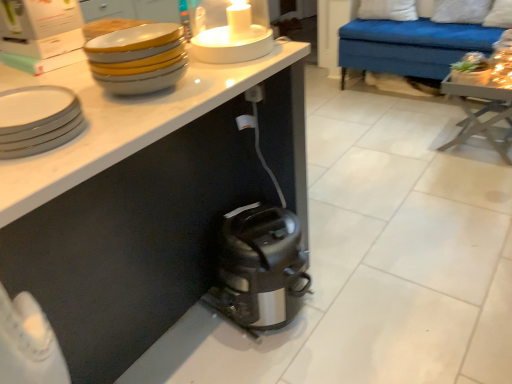
Identify the location of vacant area that lies in front of satin silver toaster at lower center. The width and height of the screenshot is (512, 384). (277, 357).